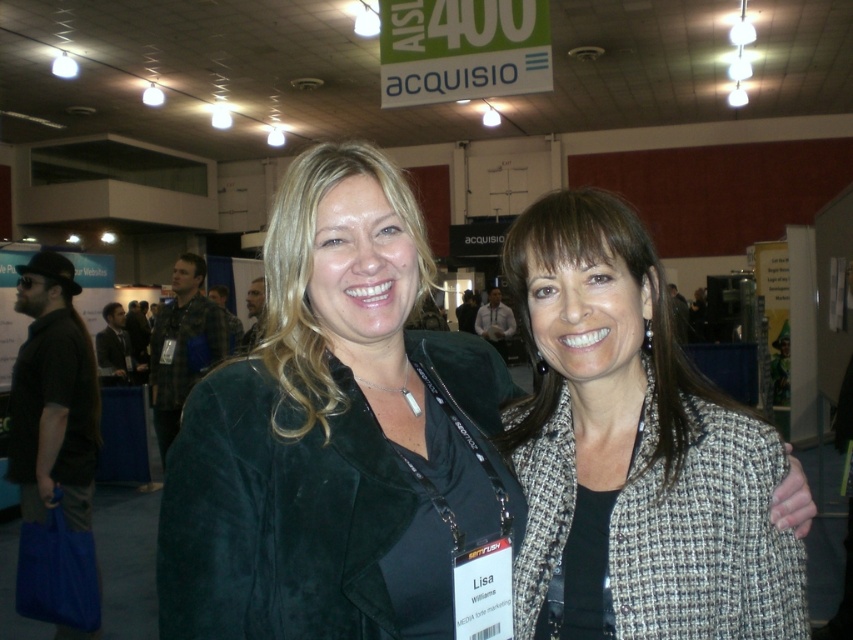
Which is more to the left, velvet black jacket at center or gray tweed blazer at center?

velvet black jacket at center is more to the left.

Who is lower down, velvet black jacket at center or gray tweed blazer at center?

gray tweed blazer at center is below.

This screenshot has width=853, height=640. What do you see at coordinates (334, 433) in the screenshot? I see `velvet black jacket at center` at bounding box center [334, 433].

You are a GUI agent. You are given a task and a screenshot of the screen. Output one action in this format:
    pyautogui.click(x=<x>, y=<y>)
    Task: Click on the velvet black jacket at center
    This screenshot has height=640, width=853.
    Given the screenshot: What is the action you would take?
    pyautogui.click(x=334, y=433)